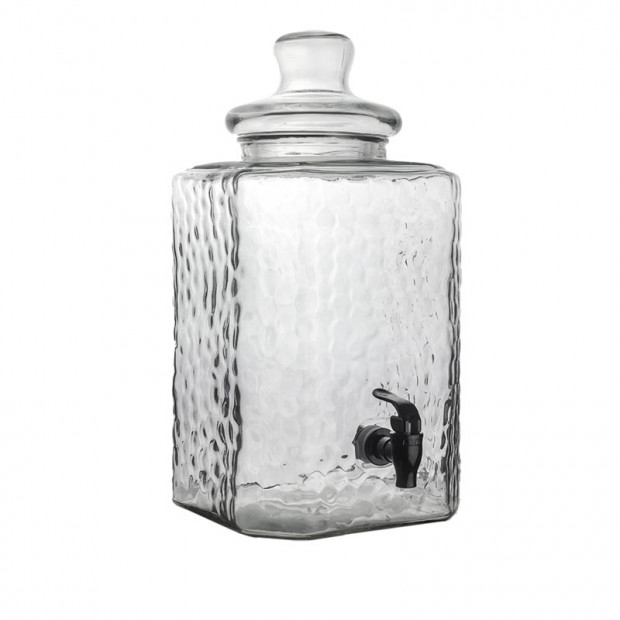
Locate an element on the screen. This screenshot has width=620, height=620. glass flask is located at coordinates (268, 188).